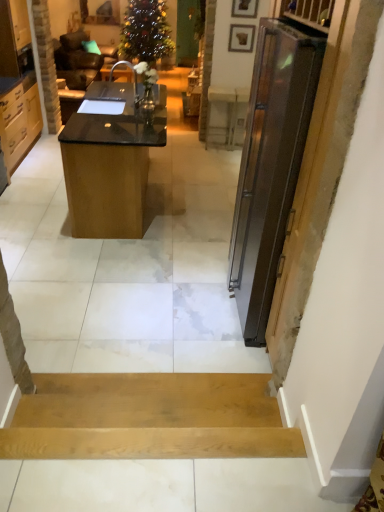
Question: In terms of size, does light brown wood drawers at left, the first cabinetry in the top-to-bottom sequence, appear bigger or smaller than wooden picture frame at upper center, the 1th picture frame ordered from the bottom?

Choices:
 (A) big
 (B) small

Answer: (A)

Question: From a real-world perspective, is light brown wood drawers at left, the first cabinetry in the top-to-bottom sequence, above or below wooden picture frame at upper center, which ranks as the second picture frame in top-to-bottom order?

Choices:
 (A) above
 (B) below

Answer: (B)

Question: Estimate the real-world distances between objects in this image. Which object is closer to the light wood cabinet at left, placed as the first cabinetry when sorted from bottom to top?

Choices:
 (A) black glossy desk at center
 (B) light brown wood drawers at left, the 2th cabinetry ordered from the bottom
 (C) wooden picture frame at upper center, the 1th picture frame viewed from the front
 (D) wooden picture frame at upper center, which ranks as the second picture frame in top-to-bottom order

Answer: (B)

Question: Estimate the real-world distances between objects in this image. Which object is farther from the light brown wood drawers at left, the 2th cabinetry ordered from the bottom?

Choices:
 (A) wooden picture frame at upper center, the 2th picture frame viewed from the back
 (B) light wood cabinet at left, placed as the first cabinetry when sorted from bottom to top
 (C) black glossy desk at center
 (D) wooden picture frame at upper center, the 1th picture frame from the back

Answer: (A)